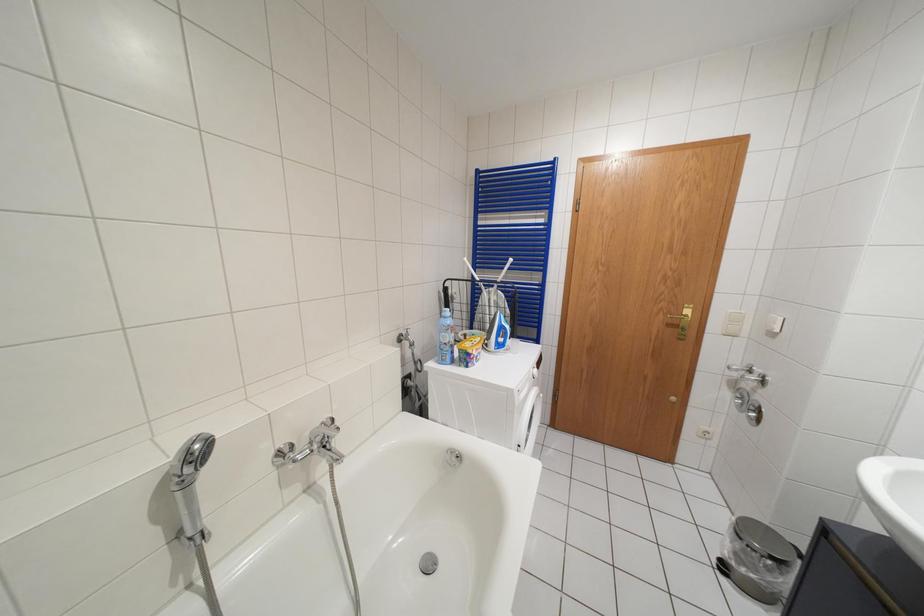
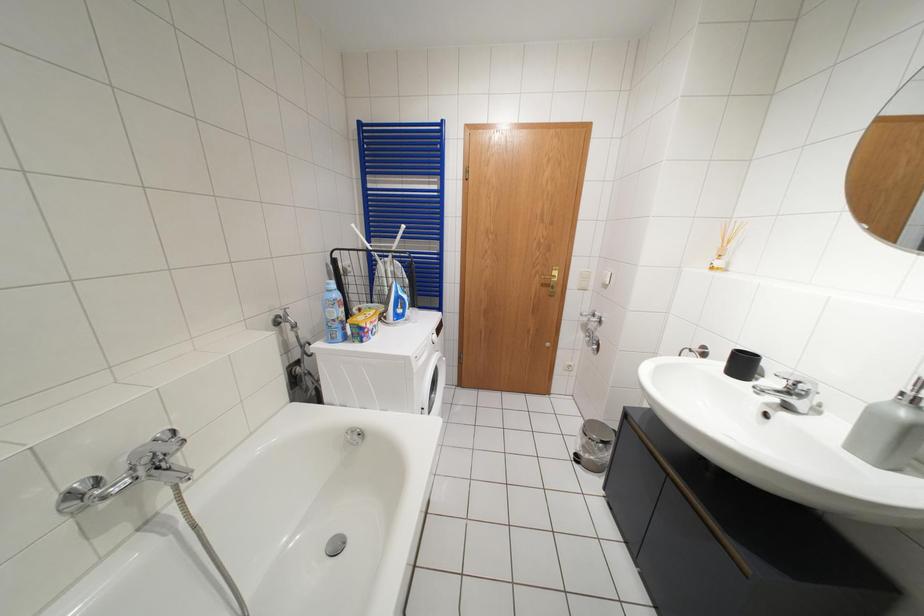
Question: What movement of the cameraman would produce the second image?

Choices:
 (A) Left
 (B) Right
 (C) Forward
 (D) Backward

Answer: (B)